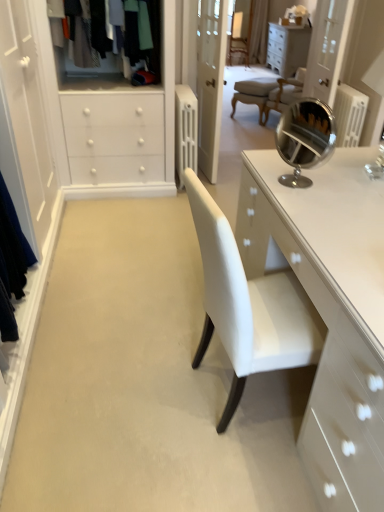
Question: From the image's perspective, would you say white glossy cabinet at upper center is shown under textured wool sweater at upper left?

Choices:
 (A) yes
 (B) no

Answer: (B)

Question: From a real-world perspective, is white glossy cabinet at upper center located beneath textured wool sweater at upper left?

Choices:
 (A) yes
 (B) no

Answer: (A)

Question: Is white glossy cabinet at upper center wider than textured wool sweater at upper left?

Choices:
 (A) yes
 (B) no

Answer: (B)

Question: Is white glossy cabinet at upper center to the right of textured wool sweater at upper left from the viewer's perspective?

Choices:
 (A) no
 (B) yes

Answer: (B)

Question: Can you confirm if white glossy cabinet at upper center is shorter than textured wool sweater at upper left?

Choices:
 (A) no
 (B) yes

Answer: (A)

Question: Is white glossy cabinet at upper center taller than textured wool sweater at upper left?

Choices:
 (A) no
 (B) yes

Answer: (B)

Question: From a real-world perspective, is transparent glass door at upper right located beneath textured wool sweater at upper left?

Choices:
 (A) no
 (B) yes

Answer: (B)

Question: Is transparent glass door at upper right looking in the opposite direction of textured wool sweater at upper left?

Choices:
 (A) yes
 (B) no

Answer: (B)

Question: Can you confirm if transparent glass door at upper right is thinner than textured wool sweater at upper left?

Choices:
 (A) yes
 (B) no

Answer: (A)

Question: From the image's perspective, does transparent glass door at upper right appear higher than textured wool sweater at upper left?

Choices:
 (A) no
 (B) yes

Answer: (B)

Question: From the image's perspective, would you say transparent glass door at upper right is shown under textured wool sweater at upper left?

Choices:
 (A) no
 (B) yes

Answer: (A)

Question: Is the position of transparent glass door at upper right less distant than that of textured wool sweater at upper left?

Choices:
 (A) yes
 (B) no

Answer: (B)

Question: Does white glossy cabinet at upper center appear on the right side of transparent glass door at upper right?

Choices:
 (A) no
 (B) yes

Answer: (B)